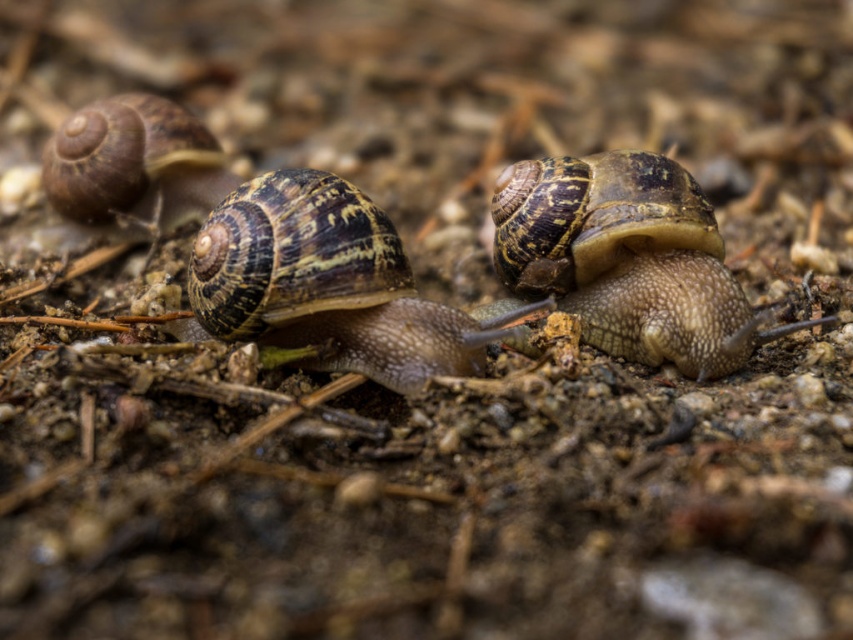
Does shiny brown snail at center appear on the left side of shiny brown shell at center?

No, shiny brown snail at center is not to the left of shiny brown shell at center.

Which is above, shiny brown snail at center or shiny brown shell at center?

shiny brown snail at center is above.

Locate an element on the screen. The height and width of the screenshot is (640, 853). shiny brown snail at center is located at coordinates (625, 259).

I want to click on shiny brown snail at center, so click(625, 259).

The width and height of the screenshot is (853, 640). I want to click on shiny brown shell at center, so click(x=328, y=284).

Is point (305, 262) positioned before point (137, 141)?

Yes.

This screenshot has width=853, height=640. Identify the location of shiny brown shell at center. (328, 284).

Which of these two, shiny brown snail at center or shiny brown shell at left, stands taller?

shiny brown snail at center

Which is behind, point (494, 221) or point (212, 205)?

Point (212, 205)

Find the location of a particular element. The width and height of the screenshot is (853, 640). shiny brown snail at center is located at coordinates (625, 259).